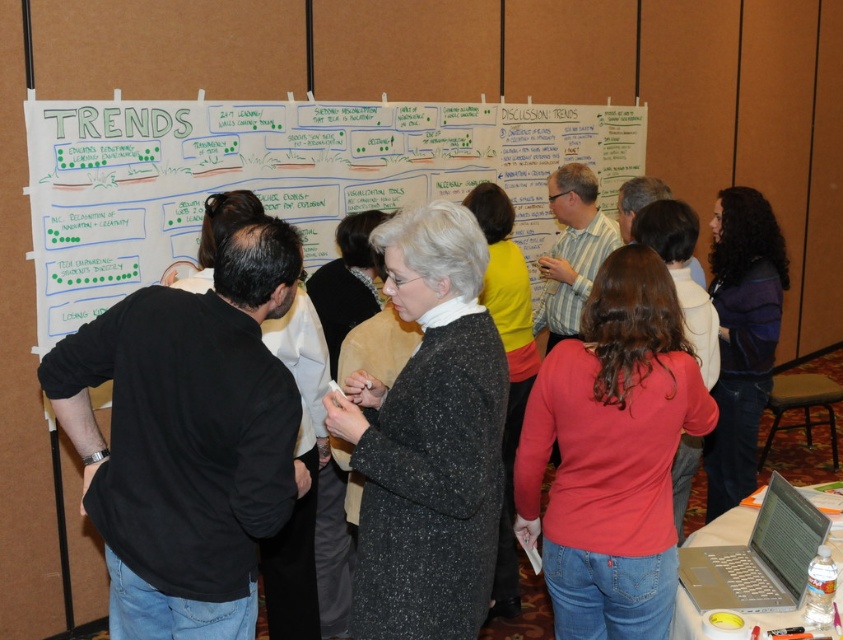
You are standing in a conference room and want to take a photo of the whiteboard. The camera you have is 1.86 meters away from the point labeled as point (492, 330). Can you estimate if the whiteboard will fit in the camera frame if the camera has a field of view of 60 degrees?

The point labeled as point (492, 330) and the camera are 1.86 meters apart. With a camera field of view of 60 degrees, the whiteboard will fit within the frame as the distance and angle allow the entire whiteboard to be captured.

You are standing in a conference room and want to read the notes on the white paperboard at center. There is a person in a dark blue sweater at right blocking your view. Can you move around them to see the board better?

The white paperboard at center is closer to the viewer than the dark blue sweater at right. Since the board is closer, you can move to either side of the person in the dark blue sweater at right to get a better view of the board without obstruction.

You are a participant in the meeting and need to present your idea to the group. You are standing next to the dark blue sweater at right. Can you see the top of the white paperboard at center from your current position?

The white paperboard at center is taller than the dark blue sweater at right, so yes, you can see the top of the white paperboard at center from your current position.